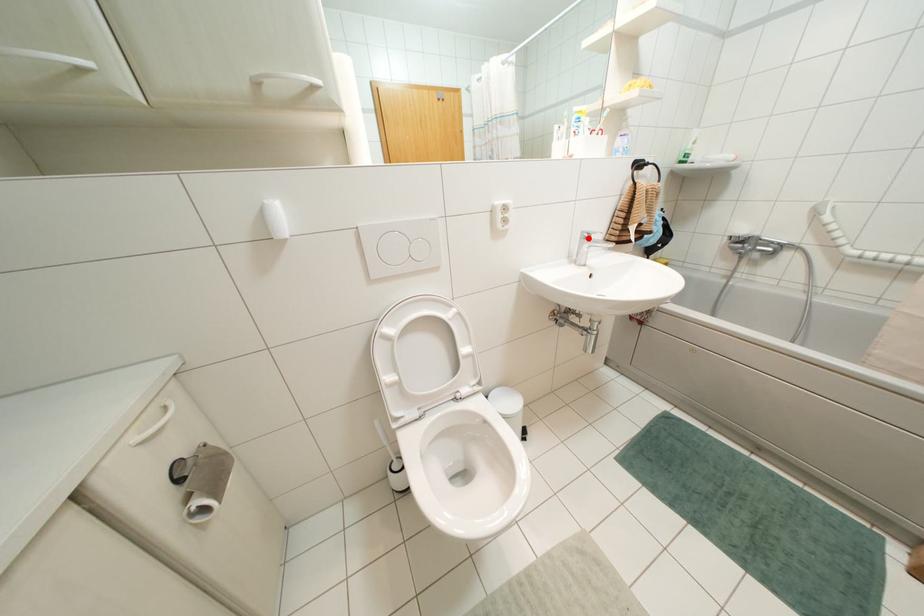
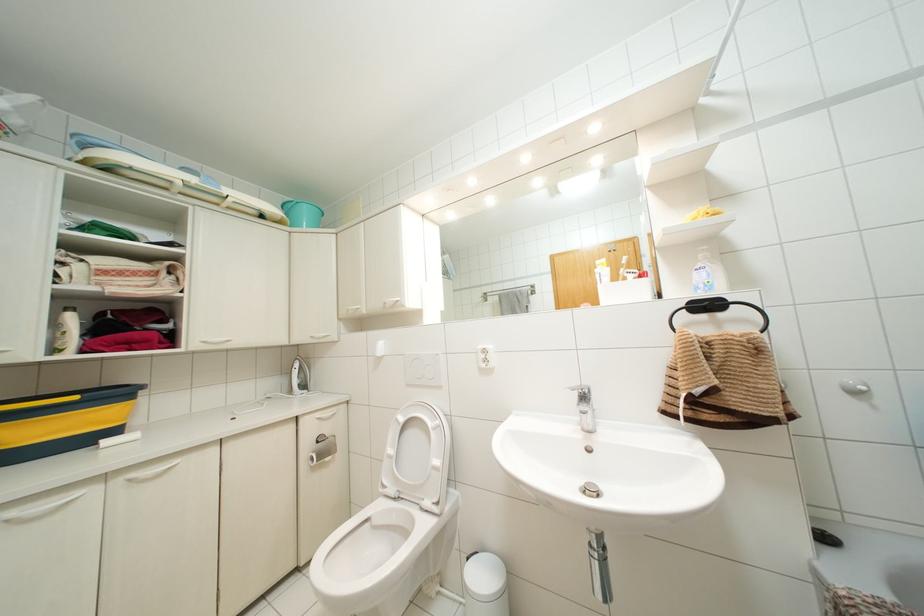
Where in the second image is the point corresponding to the highlighted location from the first image?

(584, 395)